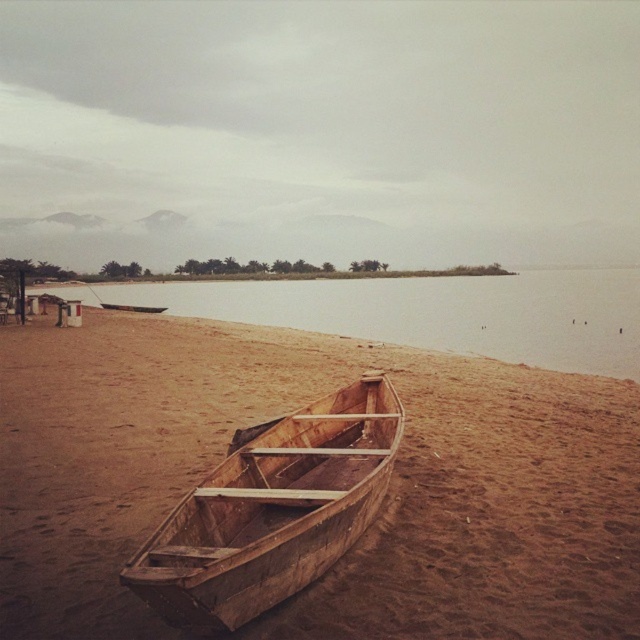
Question: Which is farther from the wooden boat at center?

Choices:
 (A) brown sand at lower left
 (B) brown wooden boat at center

Answer: (A)

Question: Is wooden boat at center above brown sand at lower left?

Choices:
 (A) yes
 (B) no

Answer: (B)

Question: Which object is the farthest from the brown wooden boat at center?

Choices:
 (A) wooden canoe at center
 (B) brown sand at lower left

Answer: (A)

Question: Is brown wooden boat at center bigger than wooden boat at center?

Choices:
 (A) no
 (B) yes

Answer: (B)

Question: Among these points, which one is farthest from the camera?

Choices:
 (A) (138, 308)
 (B) (349, 632)
 (C) (298, 451)

Answer: (A)

Question: Is wooden boat at center below brown sand at lower left?

Choices:
 (A) no
 (B) yes

Answer: (B)